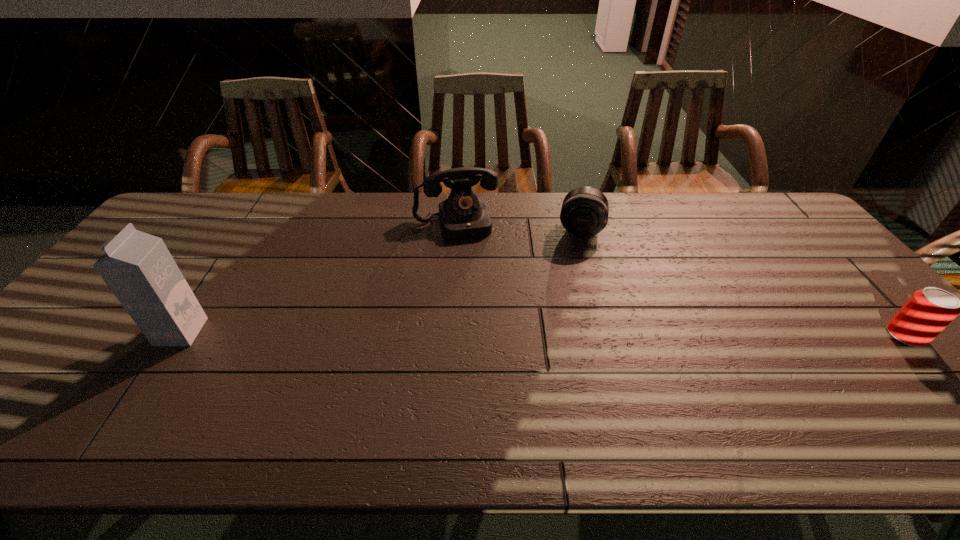
This screenshot has height=540, width=960. I want to click on the leftmost object, so click(x=138, y=268).

Locate an element on the screen. the tallest object is located at coordinates (138, 268).

Where is `beer can`? beer can is located at coordinates (929, 311).

What are the coordinates of `the third object from left to right` in the screenshot? It's located at (584, 213).

The image size is (960, 540). Find the location of `the third object from right to left`. the third object from right to left is located at coordinates (463, 215).

The height and width of the screenshot is (540, 960). Find the location of `vacant space located on the front label of the tallest object`. vacant space located on the front label of the tallest object is located at coordinates (127, 332).

The image size is (960, 540). What are the coordinates of `vacant area located 0.220m on the front label of the tallest object` in the screenshot? It's located at (76, 332).

Where is `free space located on the front label of the tallest object`? The image size is (960, 540). free space located on the front label of the tallest object is located at coordinates (x=76, y=332).

This screenshot has height=540, width=960. Identify the location of vacant space located 0.360m on the left of the beer can. (746, 335).

The image size is (960, 540). What are the coordinates of `vacant position located on the front-facing side of the third object from left to right` in the screenshot? It's located at (574, 270).